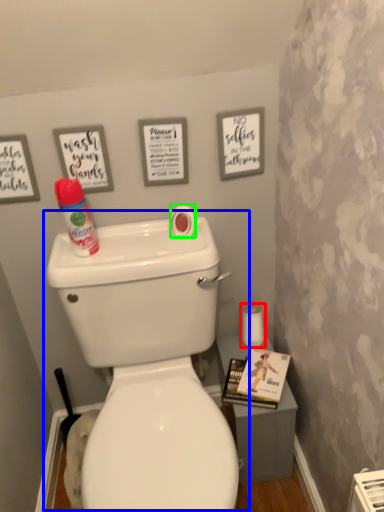
Question: Estimate the real-world distances between objects in this image. Which object is closer to toilet paper (highlighted by a red box), toilet (highlighted by a blue box) or toilet paper (highlighted by a green box)?

Choices:
 (A) toilet
 (B) toilet paper

Answer: (B)